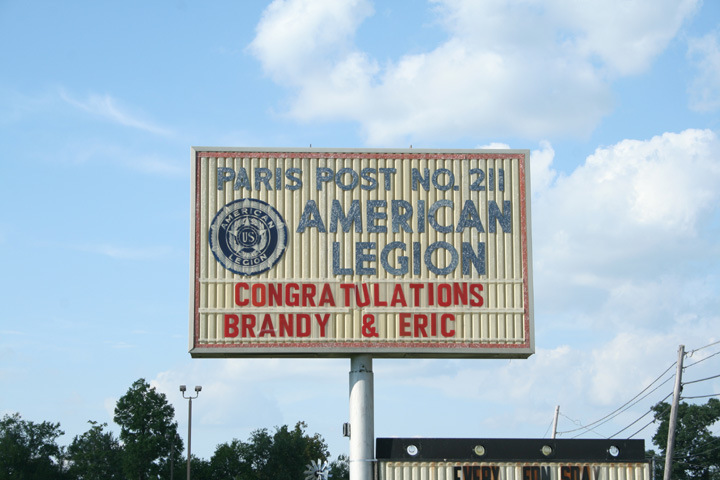
This screenshot has height=480, width=720. Find the location of `poster`. poster is located at coordinates (456, 261).